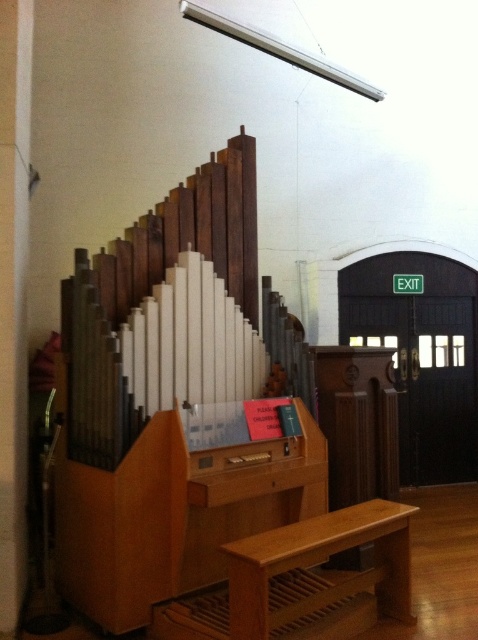
Measure the distance between point [281,582] and camera.

Point [281,582] is 11.33 feet away from camera.

Between light brown wood church bench at lower center and wooden stairs at lower center, which one has more height?

With more height is light brown wood church bench at lower center.

Identify the location of light brown wood church bench at lower center. This screenshot has height=640, width=478. (302, 580).